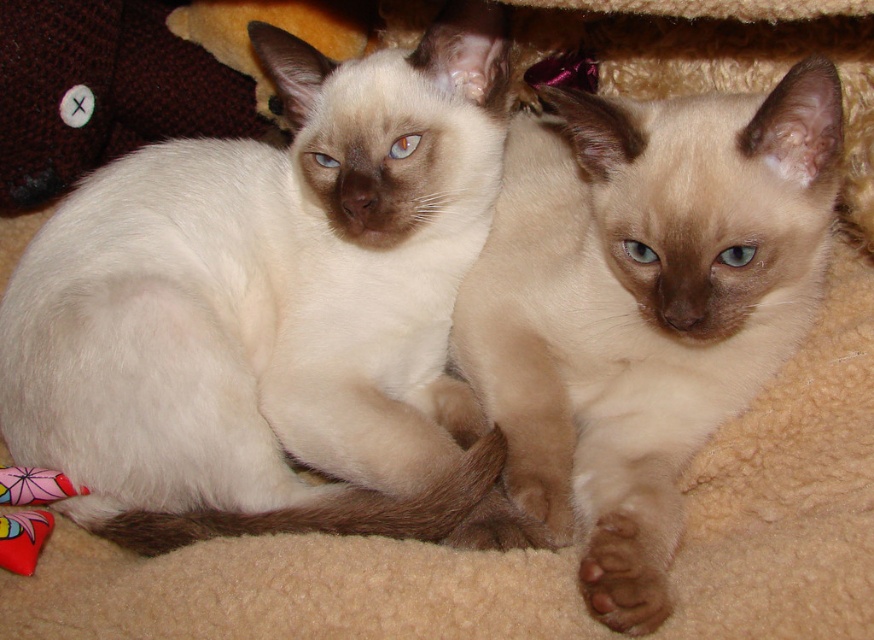
Question: Which of the following is the farthest from the observer?

Choices:
 (A) (791, 307)
 (B) (295, 352)

Answer: (B)

Question: Does silky white cat at center have a smaller size compared to silky cream cat at center?

Choices:
 (A) yes
 (B) no

Answer: (A)

Question: Which of the following is the farthest from the observer?

Choices:
 (A) (533, 508)
 (B) (224, 164)

Answer: (B)

Question: Observing the image, what is the correct spatial positioning of silky white cat at center in reference to silky cream cat at center?

Choices:
 (A) below
 (B) above

Answer: (B)

Question: Does silky white cat at center have a lesser width compared to silky cream cat at center?

Choices:
 (A) no
 (B) yes

Answer: (A)